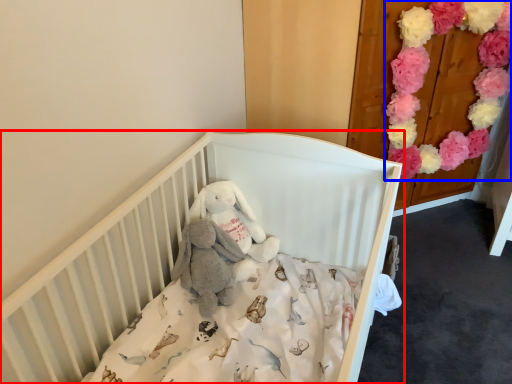
Question: Which of the following is the farthest to the observer, infant bed (highlighted by a red box) or flower (highlighted by a blue box)?

Choices:
 (A) infant bed
 (B) flower

Answer: (B)